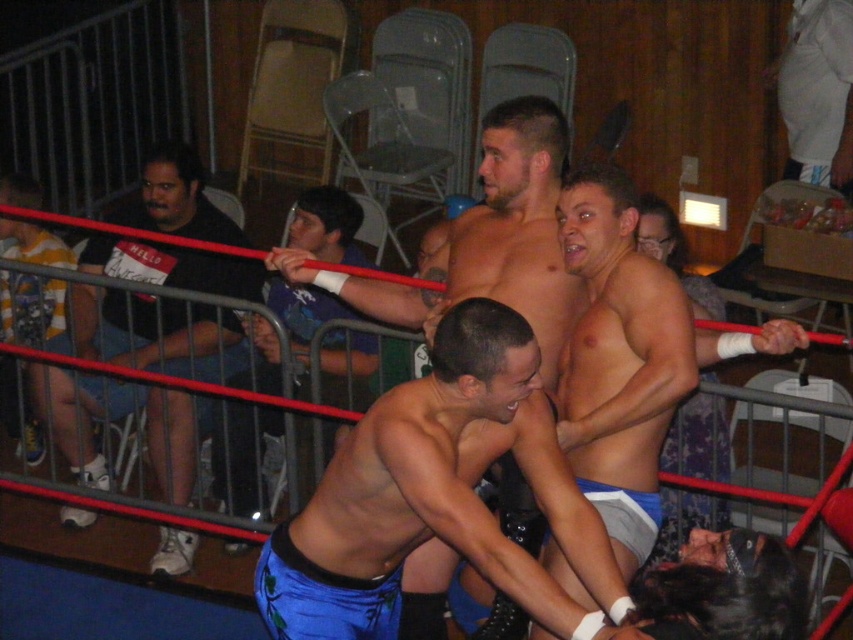
Question: Considering the relative positions of smooth skin torso at center and white fabric pants at upper right in the image provided, where is smooth skin torso at center located with respect to white fabric pants at upper right?

Choices:
 (A) below
 (B) above

Answer: (A)

Question: Which of the following is the closest to the observer?

Choices:
 (A) shiny blue shorts at center
 (B) smooth skin torso at center
 (C) white fabric pants at upper right

Answer: (B)

Question: Is smooth skin man at center to the right of white fabric pants at upper right from the viewer's perspective?

Choices:
 (A) no
 (B) yes

Answer: (A)

Question: Is smooth skin man at center positioned at the back of shiny blue shorts at center?

Choices:
 (A) no
 (B) yes

Answer: (A)

Question: Which point is farther to the camera?

Choices:
 (A) (596, 202)
 (B) (268, 458)

Answer: (B)

Question: Which point appears farthest from the camera in this image?

Choices:
 (A) (602, 349)
 (B) (248, 321)
 (C) (839, 164)

Answer: (C)